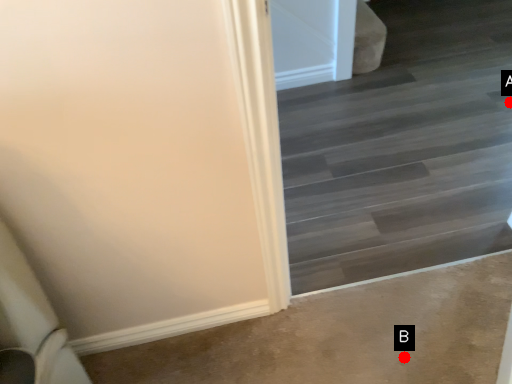
Question: Two points are circled on the image, labeled by A and B beside each circle. Which of the following is the farthest from the observer?

Choices:
 (A) A is further
 (B) B is further

Answer: (A)